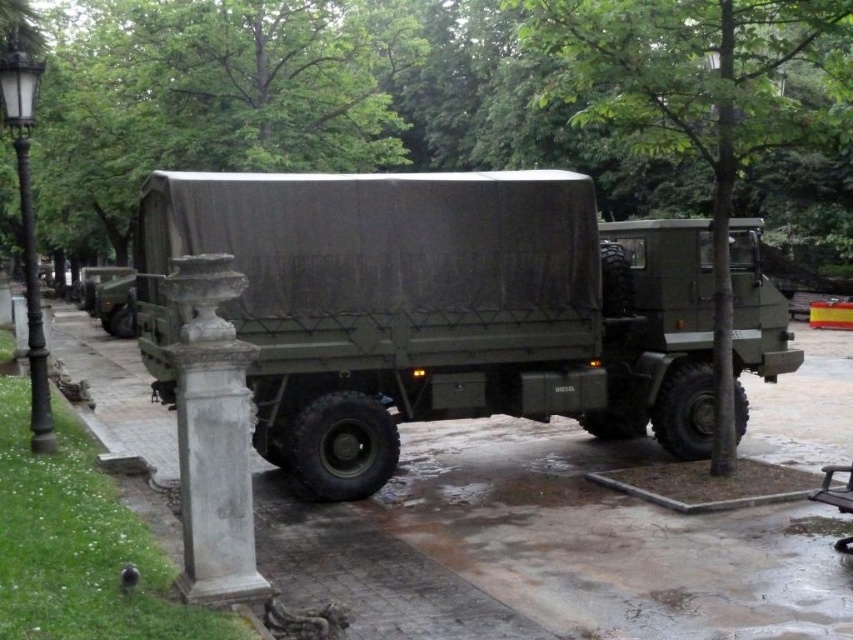
Between matte green truck at center and white stone column at lower left, which one is positioned higher?

matte green truck at center is above.

Which is behind, point (506, 304) or point (181, 449)?

The point (506, 304) is more distant.

Where is `matte green truck at center`? matte green truck at center is located at coordinates (437, 308).